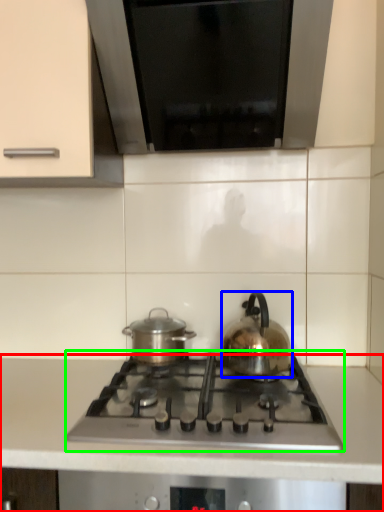
Question: Which object is positioned closest to countertop (highlighted by a red box)? Select from kettle (highlighted by a blue box) and gas stove (highlighted by a green box).

Choices:
 (A) kettle
 (B) gas stove

Answer: (B)